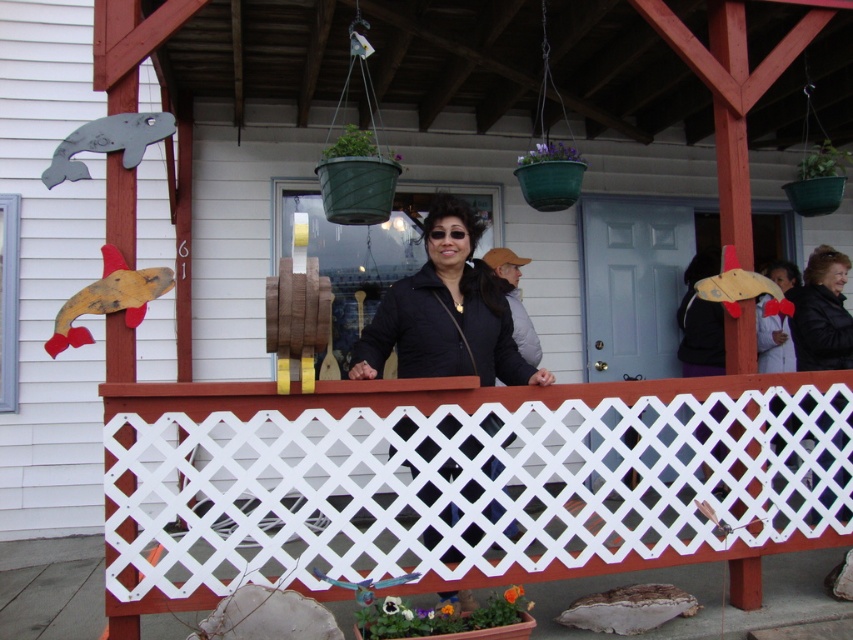
Can you confirm if white lattice at center is positioned below black matte jacket at center?

Yes.

Between white lattice at center and black matte jacket at center, which one is positioned lower?

white lattice at center is below.

Is point (555, 484) positioned in front of point (425, 368)?

No, it is not.

Where is `white lattice at center`? The width and height of the screenshot is (853, 640). white lattice at center is located at coordinates (459, 481).

The image size is (853, 640). Identify the location of white lattice at center. (459, 481).

Who is more distant from viewer, (407, 419) or (798, 304)?

The point (798, 304) is more distant.

Between point (158, 600) and point (838, 336), which one is positioned behind?

Positioned behind is point (838, 336).

This screenshot has height=640, width=853. I want to click on white lattice at center, so click(459, 481).

Is point (444, 424) behind point (817, 292)?

No, (444, 424) is closer to viewer.

Can you confirm if black matte jacket at center is wider than black leather jacket at right?

Yes.

Locate an element on the screen. The width and height of the screenshot is (853, 640). black matte jacket at center is located at coordinates (447, 312).

Where is `black matte jacket at center`? The image size is (853, 640). black matte jacket at center is located at coordinates (447, 312).